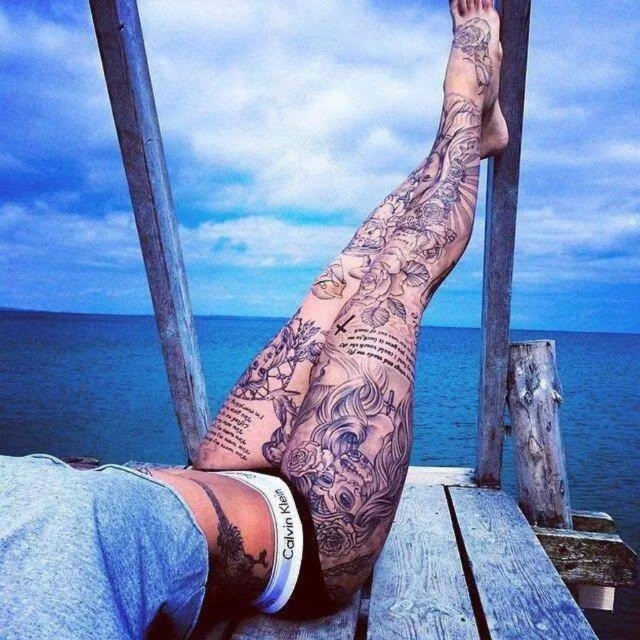
Between transparent water at lower center and black tattooed arm at upper center, which one appears on the left side from the viewer's perspective?

black tattooed arm at upper center is more to the left.

Between point (449, 426) and point (326, 269), which one is positioned behind?

Point (449, 426)

The width and height of the screenshot is (640, 640). What do you see at coordinates (83, 387) in the screenshot?
I see `transparent water at lower center` at bounding box center [83, 387].

This screenshot has height=640, width=640. In order to click on transparent water at lower center in this screenshot , I will do `click(83, 387)`.